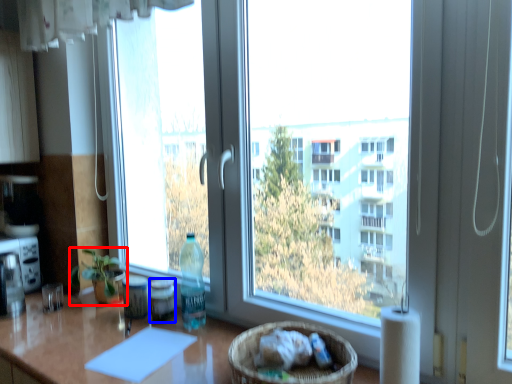
Question: Which point is closer to the camera, houseplant (highlighted by a red box) or bottle (highlighted by a blue box)?

Choices:
 (A) houseplant
 (B) bottle

Answer: (B)